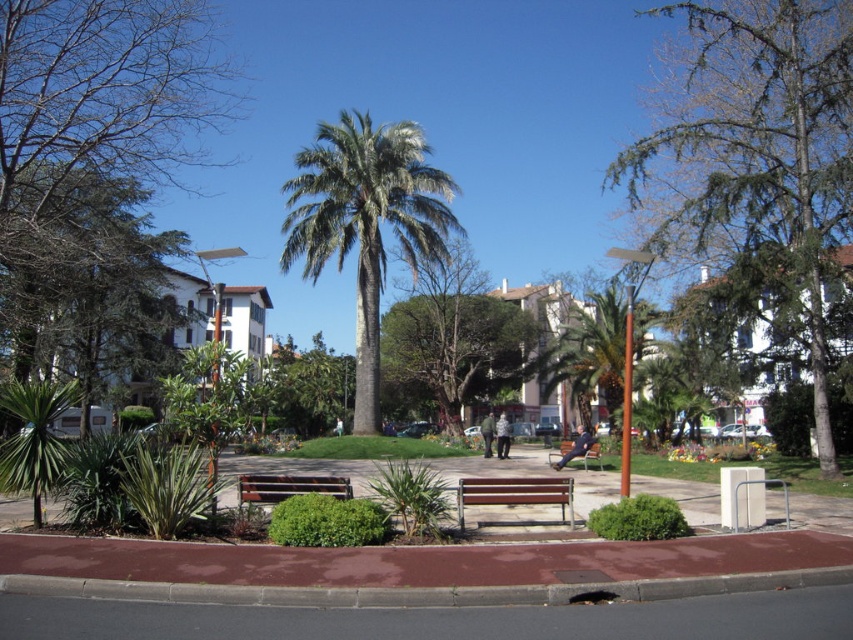
Question: Can you confirm if green textured tree at center is positioned to the left of wooden bench at center?

Choices:
 (A) yes
 (B) no

Answer: (B)

Question: Which object is farther from the camera taking this photo?

Choices:
 (A) green textured tree at center
 (B) brown wooden bench at center
 (C) green leafy tree at upper left

Answer: (A)

Question: Does green leafy tree at upper left appear under green textured tree at center?

Choices:
 (A) yes
 (B) no

Answer: (A)

Question: Can you confirm if wooden bench at center is positioned to the left of wooden park bench at center?

Choices:
 (A) yes
 (B) no

Answer: (A)

Question: Which point is farther to the camera?

Choices:
 (A) (247, 502)
 (B) (795, 260)

Answer: (B)

Question: Considering the real-world distances, which object is farthest from the green textured tree at center?

Choices:
 (A) brown wooden bench at center
 (B) wooden park bench at center

Answer: (A)